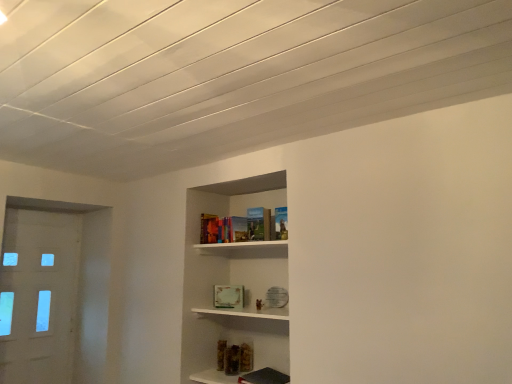
Question: From the image's perspective, is white glossy door at left above matte hardcover book at center?

Choices:
 (A) yes
 (B) no

Answer: (B)

Question: Is white glossy door at left positioned far away from matte hardcover book at center?

Choices:
 (A) yes
 (B) no

Answer: (A)

Question: Is matte hardcover book at center inside white glossy door at left?

Choices:
 (A) yes
 (B) no

Answer: (B)

Question: Could you tell me if white glossy door at left is facing matte hardcover book at center?

Choices:
 (A) yes
 (B) no

Answer: (A)

Question: Considering the relative positions of white glossy door at left and matte hardcover book at center in the image provided, is white glossy door at left to the right of matte hardcover book at center from the viewer's perspective?

Choices:
 (A) yes
 (B) no

Answer: (B)

Question: Considering the relative sizes of white glossy door at left and matte hardcover book at center in the image provided, is white glossy door at left wider than matte hardcover book at center?

Choices:
 (A) no
 (B) yes

Answer: (A)

Question: Is the position of matte hardcover book at center more distant than that of white glossy door at left?

Choices:
 (A) yes
 (B) no

Answer: (B)

Question: Can you confirm if matte hardcover book at center is positioned to the right of white glossy door at left?

Choices:
 (A) yes
 (B) no

Answer: (A)

Question: Considering the relative sizes of matte hardcover book at center and white glossy door at left in the image provided, is matte hardcover book at center bigger than white glossy door at left?

Choices:
 (A) no
 (B) yes

Answer: (A)

Question: Is matte hardcover book at center oriented towards white glossy door at left?

Choices:
 (A) yes
 (B) no

Answer: (B)

Question: Considering the relative sizes of matte hardcover book at center and white glossy door at left in the image provided, is matte hardcover book at center wider than white glossy door at left?

Choices:
 (A) no
 (B) yes

Answer: (B)

Question: Is matte hardcover book at center turned away from white glossy door at left?

Choices:
 (A) yes
 (B) no

Answer: (B)

Question: Considering their positions, is white glossy door at left located in front of or behind matte hardcover book at center?

Choices:
 (A) front
 (B) behind

Answer: (B)